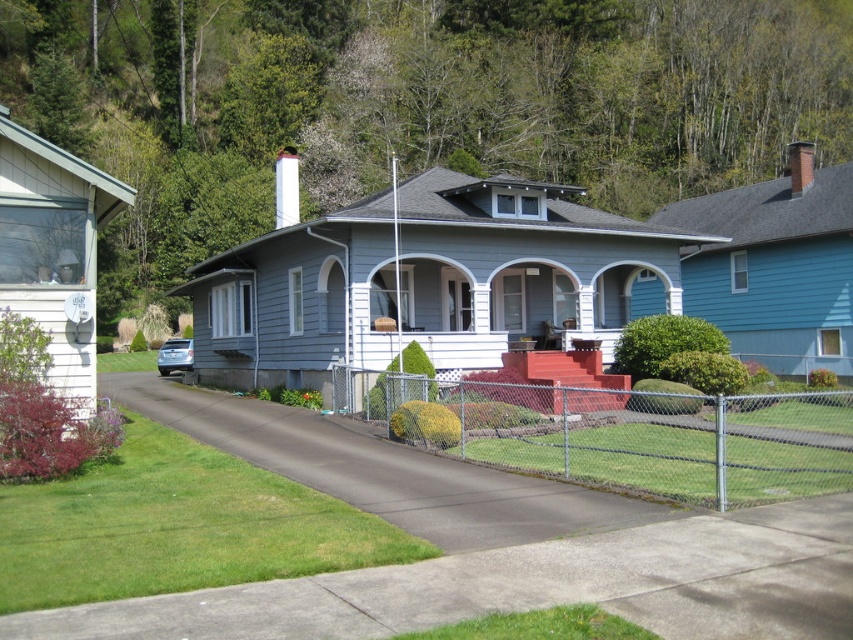
Question: Where is metallic chain-link fence at center located in relation to satin silver sedan at center in the image?

Choices:
 (A) above
 (B) below

Answer: (A)

Question: Among these points, which one is farthest from the camera?

Choices:
 (A) (183, 348)
 (B) (837, 408)

Answer: (A)

Question: Which object appears farthest from the camera in this image?

Choices:
 (A) metallic chain-link fence at center
 (B) satin silver sedan at center

Answer: (B)

Question: Which point is farther to the camera?

Choices:
 (A) (161, 356)
 (B) (653, 468)

Answer: (A)

Question: Does metallic chain-link fence at center appear under satin silver sedan at center?

Choices:
 (A) no
 (B) yes

Answer: (A)

Question: Can you confirm if metallic chain-link fence at center is bigger than satin silver sedan at center?

Choices:
 (A) yes
 (B) no

Answer: (A)